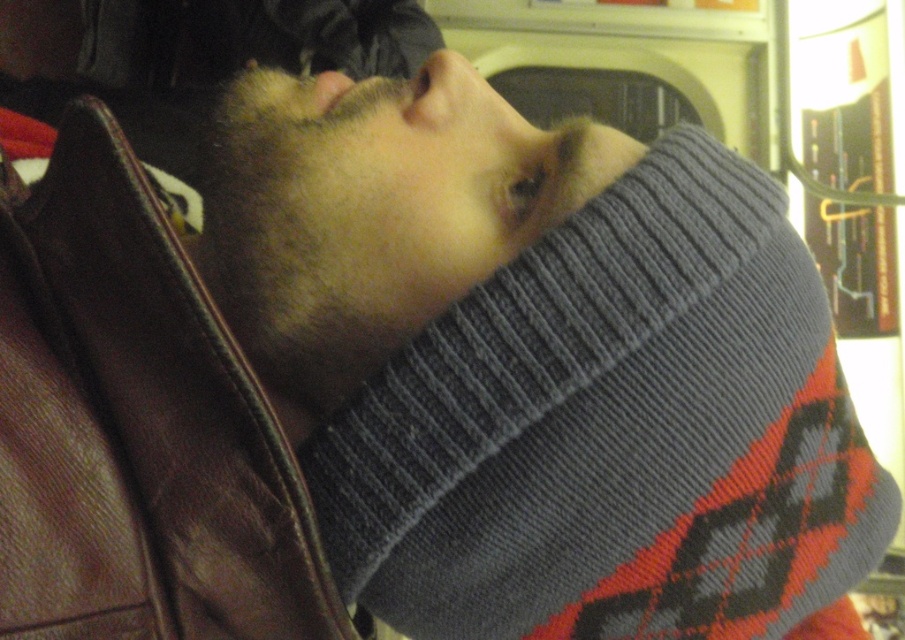
Is brown leather jacket at left to the right of gray knitted sweater at center from the viewer's perspective?

No, brown leather jacket at left is not to the right of gray knitted sweater at center.

Is brown leather jacket at left shorter than gray knitted sweater at center?

In fact, brown leather jacket at left may be taller than gray knitted sweater at center.

In order to click on brown leather jacket at left in this screenshot , I will do `click(136, 428)`.

The width and height of the screenshot is (905, 640). In order to click on brown leather jacket at left in this screenshot , I will do `click(136, 428)`.